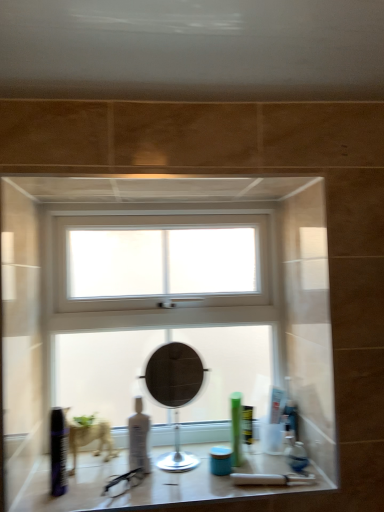
Locate an element on the screen. vacant point to the right of shiny black can at lower left, marked as the 4th toiletry in a right-to-left arrangement is located at coordinates (114, 495).